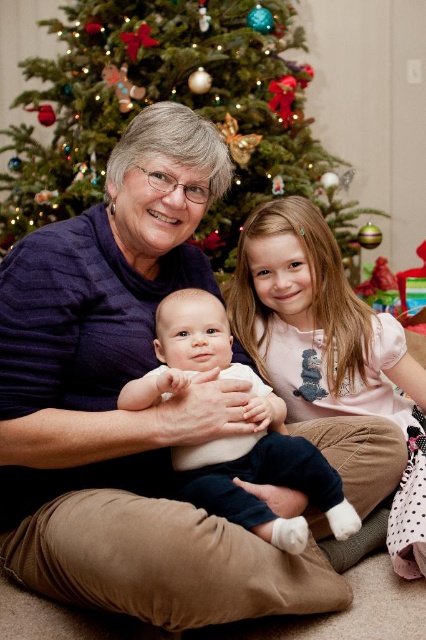
Between green textured christmas tree at upper center and white soft fabric baby at center, which one has more height?

green textured christmas tree at upper center

Between point (124, 8) and point (216, 497), which one is positioned behind?

Point (124, 8)

Locate an element on the screen. This screenshot has width=426, height=640. green textured christmas tree at upper center is located at coordinates (175, 100).

Consider the image. Can you confirm if green textured christmas tree at upper center is wider than pink satin dress at center?

Yes, green textured christmas tree at upper center is wider than pink satin dress at center.

Does green textured christmas tree at upper center have a lesser height compared to pink satin dress at center?

Incorrect, green textured christmas tree at upper center's height does not fall short of pink satin dress at center's.

Where is `green textured christmas tree at upper center`? green textured christmas tree at upper center is located at coordinates (175, 100).

I want to click on green textured christmas tree at upper center, so click(175, 100).

Between pink satin dress at center and white soft fabric baby at center, which one is positioned higher?

pink satin dress at center is above.

Is pink satin dress at center positioned at the back of white soft fabric baby at center?

Yes.

The image size is (426, 640). What do you see at coordinates (328, 348) in the screenshot?
I see `pink satin dress at center` at bounding box center [328, 348].

You are a GUI agent. You are given a task and a screenshot of the screen. Output one action in this format:
    pyautogui.click(x=<x>, y=<y>)
    Task: Click on the pink satin dress at center
    This screenshot has height=640, width=426.
    Given the screenshot: What is the action you would take?
    coord(328,348)